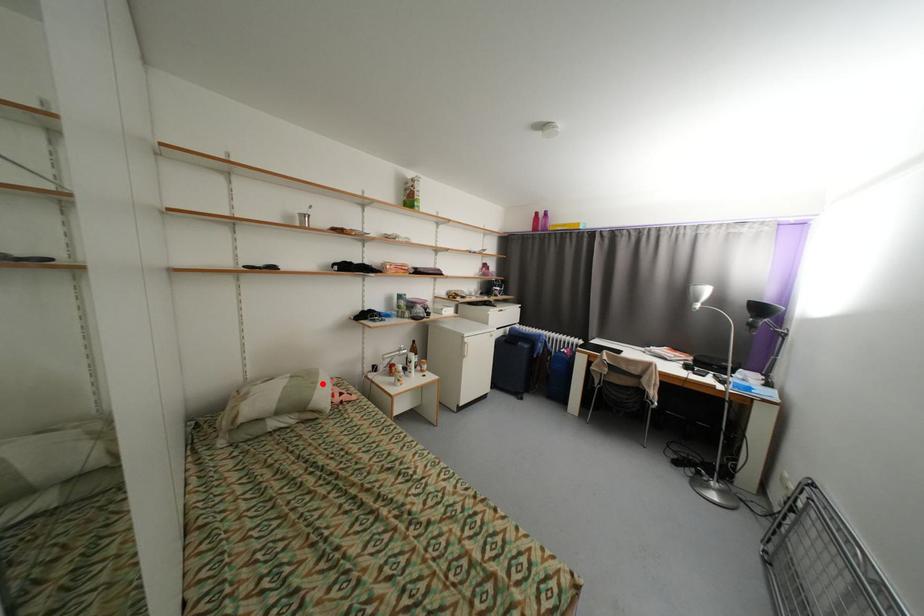
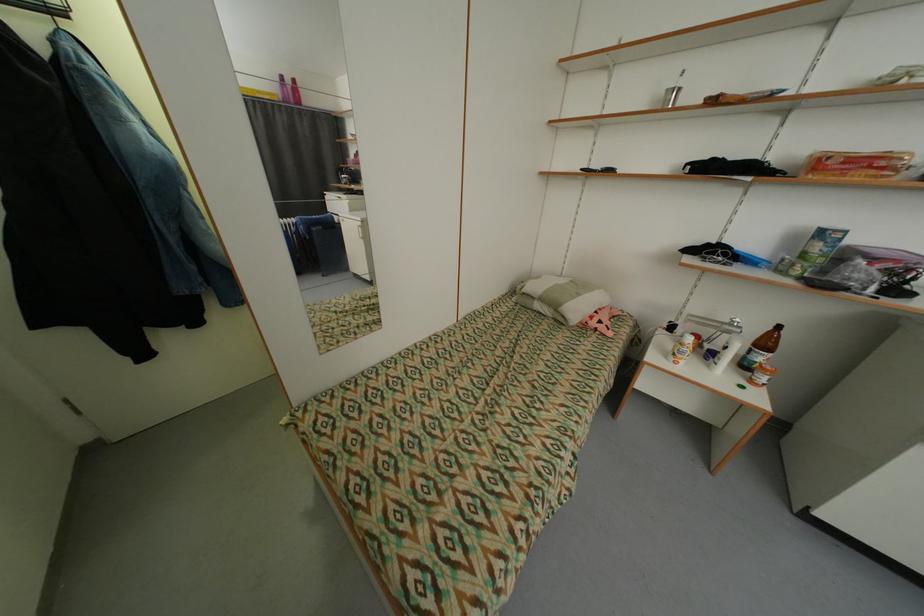
Find the pixel in the second image that matches the highlighted location in the first image.

(585, 296)